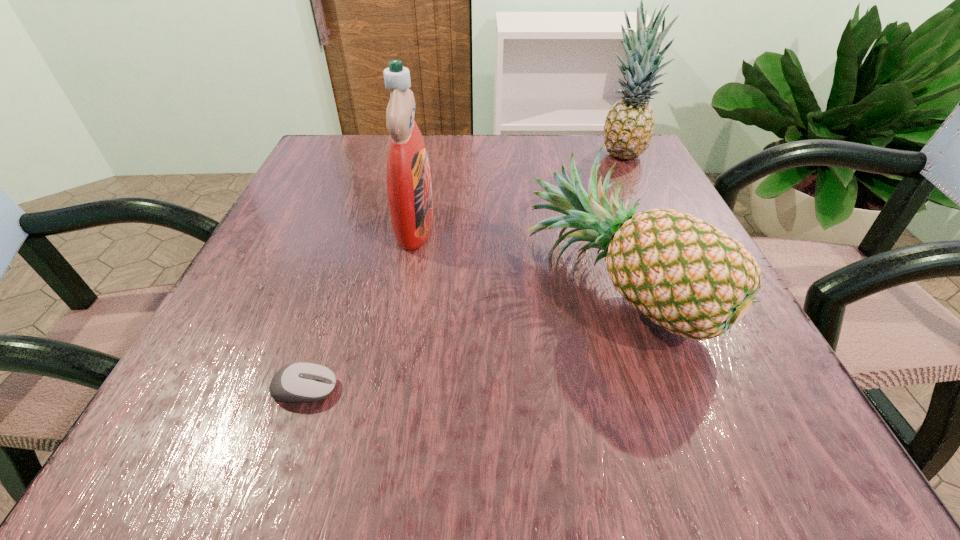
Find the location of a particular element. This screenshot has width=960, height=540. the taller pineapple is located at coordinates (629, 124).

Identify the location of the farthest object. This screenshot has width=960, height=540. (629, 124).

Identify the location of detergent. This screenshot has height=540, width=960. (409, 188).

Where is `the shorter pineapple`? Image resolution: width=960 pixels, height=540 pixels. the shorter pineapple is located at coordinates (684, 274).

At what (x,y) coordinates should I click in order to perform the action: click on the third tallest object. Please return your answer as a coordinate pair (x, y). Looking at the image, I should click on (684, 274).

The image size is (960, 540). I want to click on computer equipment, so click(298, 382).

Locate an element on the screen. Image resolution: width=960 pixels, height=540 pixels. the shortest object is located at coordinates (298, 382).

The image size is (960, 540). Find the location of `free space located 0.230m on the front of the farthest object`. free space located 0.230m on the front of the farthest object is located at coordinates (657, 230).

Identify the location of vacant area situated on the front surface of the third object from right to left. The height and width of the screenshot is (540, 960). (544, 225).

At what (x,y) coordinates should I click in order to perform the action: click on free space located on the back of the shorter pineapple. Please return your answer as a coordinate pair (x, y). The height and width of the screenshot is (540, 960). Looking at the image, I should click on (585, 192).